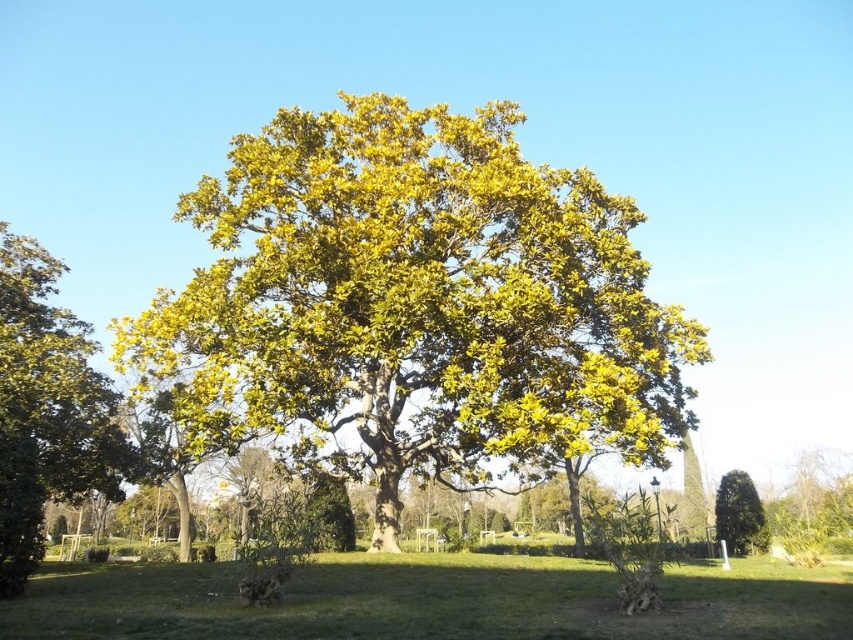
Question: Estimate the real-world distances between objects in this image. Which object is closer to the green grass at center?

Choices:
 (A) green leafy oak tree at center
 (B) green leafy tree at left
 (C) green glossy tree at lower right

Answer: (A)

Question: Which point is farther to the camera?

Choices:
 (A) green leafy oak tree at center
 (B) green leafy tree at left
 (C) green glossy tree at lower right
 (D) green grass at center

Answer: (C)

Question: Which point appears farthest from the camera in this image?

Choices:
 (A) (744, 524)
 (B) (82, 346)
 (C) (212, 348)

Answer: (A)

Question: Does green leafy oak tree at center appear over green leafy tree at left?

Choices:
 (A) no
 (B) yes

Answer: (B)

Question: Can you confirm if green grass at center is smaller than green leafy tree at left?

Choices:
 (A) yes
 (B) no

Answer: (A)

Question: Does green leafy oak tree at center have a lesser width compared to green grass at center?

Choices:
 (A) yes
 (B) no

Answer: (A)